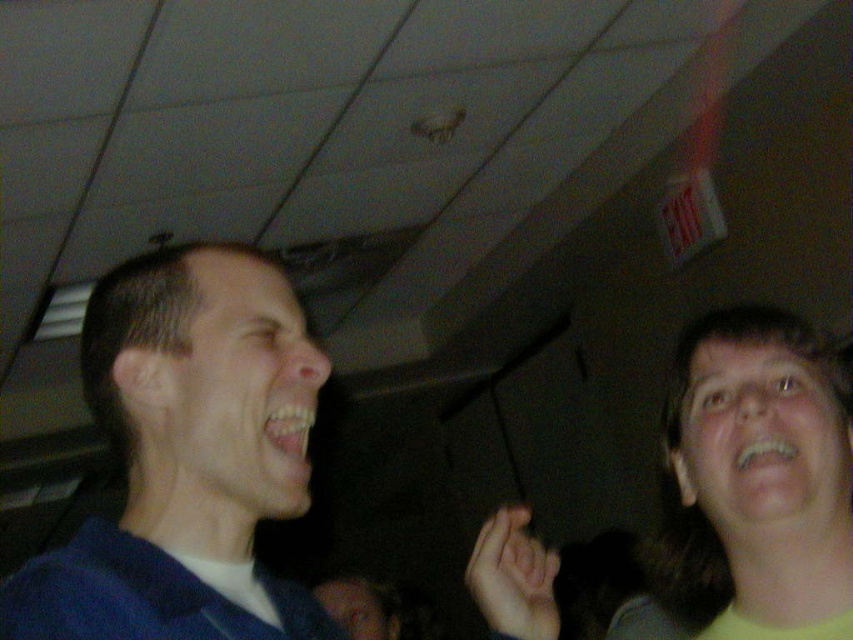
Between yellow matte face at upper right and smooth skin hand at lower right, which one is positioned lower?

smooth skin hand at lower right

Between yellow matte face at upper right and smooth skin hand at lower right, which one is positioned higher?

Positioned higher is yellow matte face at upper right.

Identify the location of yellow matte face at upper right. (752, 484).

Where is `yellow matte face at upper right`? Image resolution: width=853 pixels, height=640 pixels. yellow matte face at upper right is located at coordinates (752, 484).

Can you confirm if blue fabric shirt at left is positioned to the left of yellow matte face at upper right?

Yes, blue fabric shirt at left is to the left of yellow matte face at upper right.

Who is more forward, (171, 360) or (741, 310)?

Positioned in front is point (171, 360).

This screenshot has width=853, height=640. In order to click on blue fabric shirt at left in this screenshot , I will do `click(187, 458)`.

Who is more distant from viewer, (180,589) or (477,605)?

Point (477,605)

Is point (103, 532) positioned before point (517, 588)?

Yes, point (103, 532) is closer to viewer.

Where is `blue fabric shirt at left`? blue fabric shirt at left is located at coordinates (187, 458).